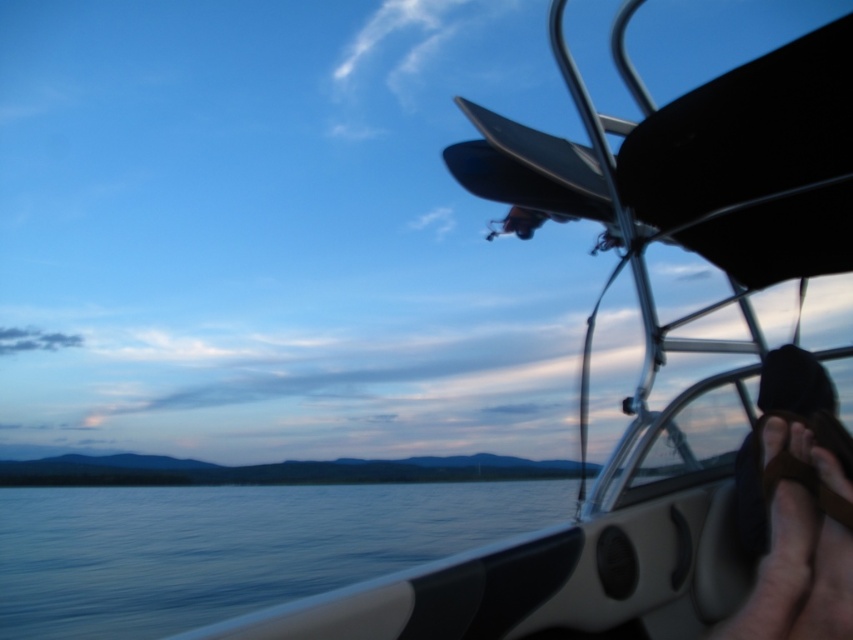
You are an interior designer assessing the boat for a client. The client wants to know if the black fabric cap at upper right can be placed on the smooth water at lower left without overlapping. Based on their widths, is this possible?

The smooth water at lower left is wider than the black fabric cap at upper right, so placing the black fabric cap at upper right on the smooth water at lower left without overlapping is possible.

You are on a boat and want to take a photo of the smooth water at lower left. Where exactly should you point your camera?

You should point your camera to point at coordinate (x=230, y=547) to capture the smooth water at lower left.